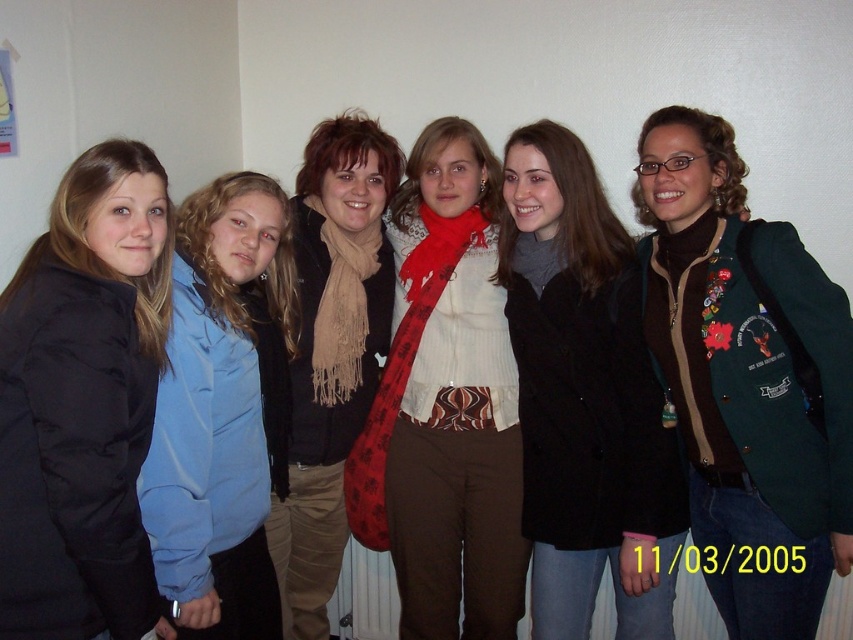
Question: Among these objects, which one is farthest from the camera?

Choices:
 (A) matte black coat at center
 (B) blue fabric shirt at left
 (C) beige scarf at center

Answer: (C)

Question: In this image, where is matte black coat at center located relative to black puffy jacket at left?

Choices:
 (A) left
 (B) right

Answer: (B)

Question: Which point appears farthest from the camera in this image?

Choices:
 (A) (293, 522)
 (B) (402, 381)

Answer: (A)

Question: Which point is farther from the camera taking this photo?

Choices:
 (A) (7, 440)
 (B) (280, 621)
 (C) (726, 211)
 (D) (610, 525)

Answer: (B)

Question: Is green textured blazer at center above red plaid scarf at center?

Choices:
 (A) no
 (B) yes

Answer: (A)

Question: Can you confirm if beige scarf at center is smaller than red plaid scarf at center?

Choices:
 (A) yes
 (B) no

Answer: (B)